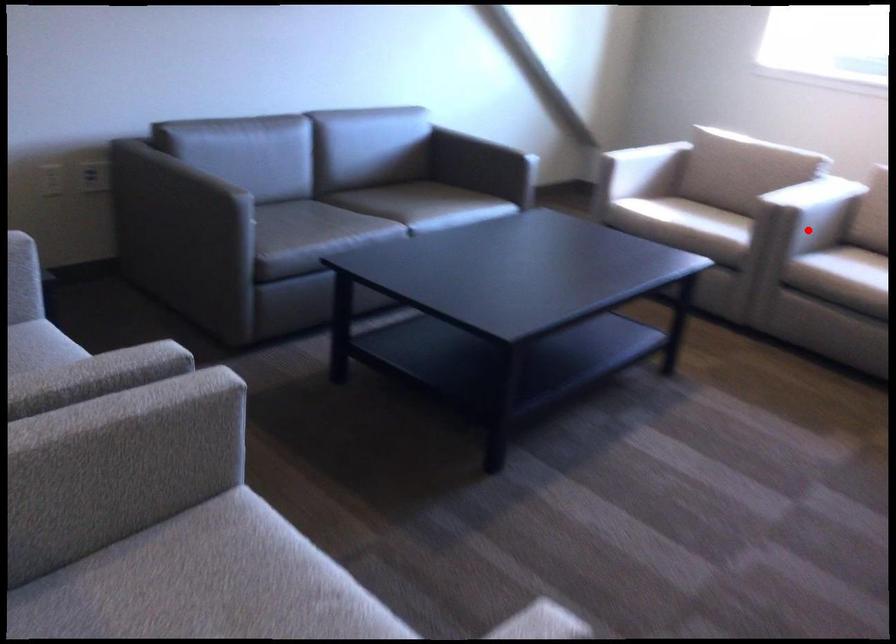
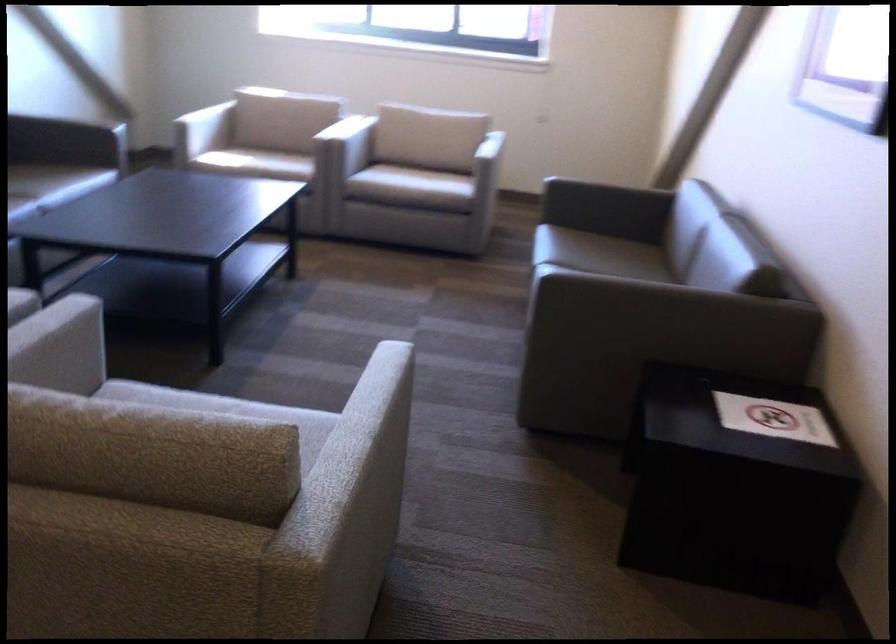
Where in the second image is the point corresponding to the highlighted location from the first image?

(347, 145)